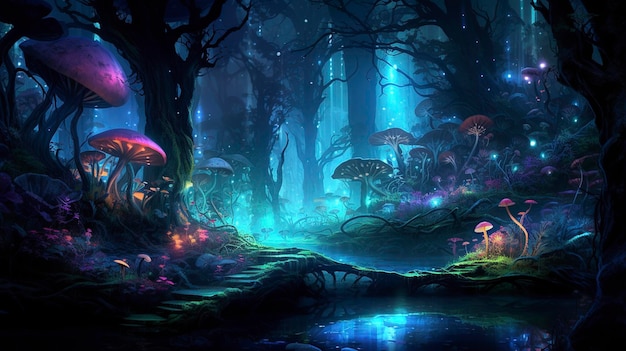
This screenshot has width=626, height=351. In order to click on stairs in this screenshot , I will do `click(242, 276)`.